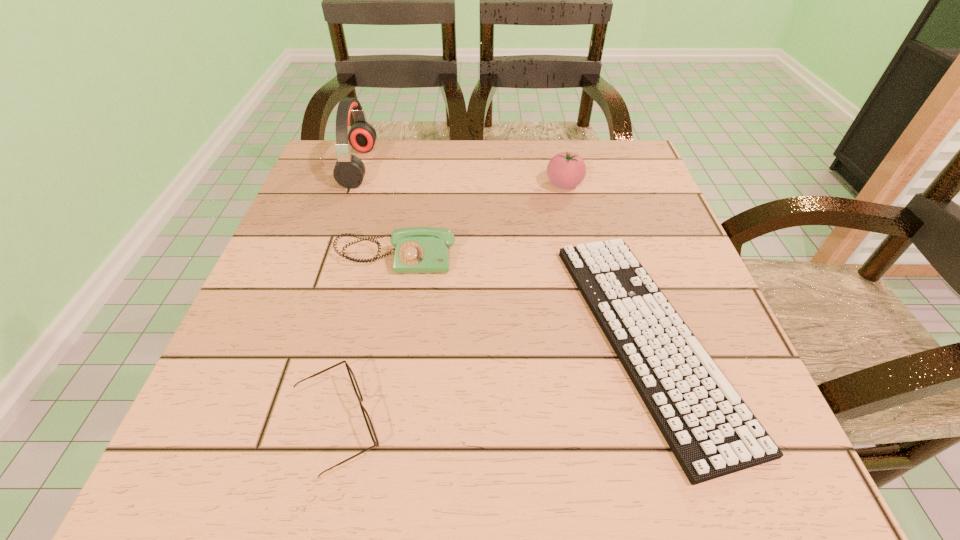
Find the location of a particular element. This screenshot has width=960, height=540. free space between the third tallest object and the fourth shortest object is located at coordinates (480, 221).

This screenshot has height=540, width=960. I want to click on vacant space that's between the second shortest object and the second tallest object, so click(x=451, y=305).

The height and width of the screenshot is (540, 960). Identify the location of vacant point located between the tomato and the third tallest object. (480, 221).

The image size is (960, 540). In order to click on blank region between the tallest object and the tomato in this screenshot , I will do `click(462, 175)`.

Find the location of a particular element. The width and height of the screenshot is (960, 540). vacant area that lies between the telephone and the shortest object is located at coordinates (522, 298).

At what (x,y) coordinates should I click in order to perform the action: click on unoccupied position between the computer keyboard and the third tallest object. Please return your answer as a coordinate pair (x, y). This screenshot has width=960, height=540. Looking at the image, I should click on (522, 298).

This screenshot has height=540, width=960. I want to click on vacant area that lies between the telephone and the tomato, so click(480, 221).

Locate an element on the screen. vacant point located between the tallest object and the spectacles is located at coordinates (348, 295).

The width and height of the screenshot is (960, 540). What are the coordinates of `object that is the second closest to the computer keyboard` in the screenshot? It's located at coord(417,249).

Select which object appears as the closest to the shortest object. Please provide its 2D coordinates. Your answer should be formatted as a tuple, i.e. [(x, y)], where the tuple contains the x and y coordinates of a point satisfying the conditions above.

[(565, 170)]